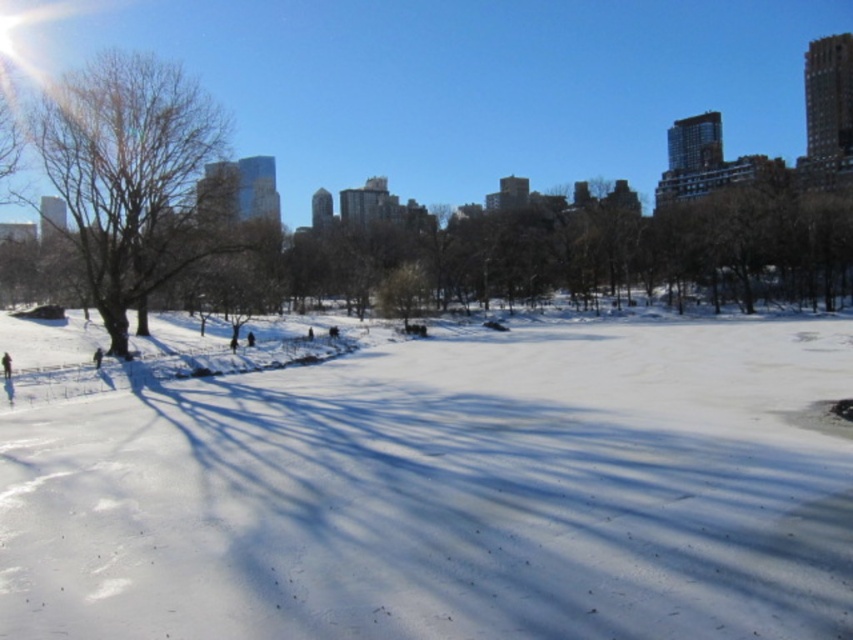
In the scene shown: You are planning to place a 50 feet long ice sculpture on the frozen lake. The sculpture needs to be placed between the bare brown tree at left and the dark blue jacket at lower left. Is there enough space between them to accommodate the sculpture?

The distance between the bare brown tree at left and the dark blue jacket at lower left is 45.21 feet, which is shorter than the 50 feet required for the ice sculpture. Therefore, there isn not enough space to place the sculpture between them.

You are standing in the winter park scene and want to take a photo of the bare brown tree at left and the dark blue jacket at lower left. Which object should you zoom in on first to ensure both are in frame?

The bare brown tree at left is taller than the dark blue jacket at lower left, so you should zoom in on the bare brown tree at left first to ensure both are in frame.

You are standing at the edge of the frozen lake in the winter scene. You see the white powdery snow at center and the dark blue jacket at lower left. Which object is closer to you?

The white powdery snow at center is closer to you than the dark blue jacket at lower left because it is in front of it.